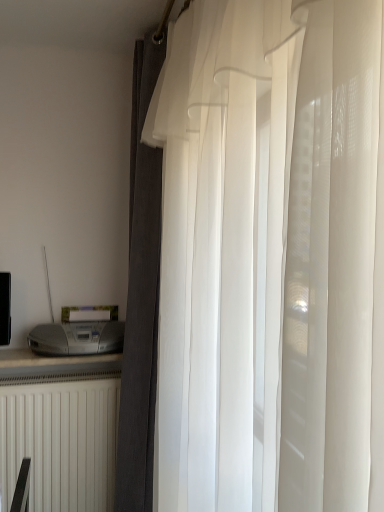
Question: Can you confirm if satin silver printer at lower left is taller than white matte radiator at lower left?

Choices:
 (A) no
 (B) yes

Answer: (A)

Question: From the image's perspective, is satin silver printer at lower left below white matte radiator at lower left?

Choices:
 (A) yes
 (B) no

Answer: (B)

Question: Considering the relative positions of satin silver printer at lower left and white matte radiator at lower left in the image provided, is satin silver printer at lower left behind white matte radiator at lower left?

Choices:
 (A) yes
 (B) no

Answer: (B)

Question: Is there a large distance between satin silver printer at lower left and white matte radiator at lower left?

Choices:
 (A) yes
 (B) no

Answer: (B)

Question: From a real-world perspective, is satin silver printer at lower left located beneath white matte radiator at lower left?

Choices:
 (A) yes
 (B) no

Answer: (B)

Question: Considering the relative sizes of satin silver printer at lower left and white matte radiator at lower left in the image provided, is satin silver printer at lower left shorter than white matte radiator at lower left?

Choices:
 (A) no
 (B) yes

Answer: (B)

Question: Does satin silver printer at lower left have a larger size compared to dark gray textured curtain at center, arranged as the 1th curtain when viewed from the back?

Choices:
 (A) yes
 (B) no

Answer: (B)

Question: Is satin silver printer at lower left not inside dark gray textured curtain at center, the second curtain from the front?

Choices:
 (A) yes
 (B) no

Answer: (A)

Question: Does satin silver printer at lower left have a greater width compared to dark gray textured curtain at center, the second curtain from the front?

Choices:
 (A) no
 (B) yes

Answer: (B)

Question: Would you say dark gray textured curtain at center, the second curtain from the front, is part of satin silver printer at lower left's contents?

Choices:
 (A) no
 (B) yes

Answer: (A)

Question: From the image's perspective, is satin silver printer at lower left over dark gray textured curtain at center, the second curtain from the front?

Choices:
 (A) yes
 (B) no

Answer: (B)

Question: Is satin silver printer at lower left oriented towards dark gray textured curtain at center, the second curtain from the front?

Choices:
 (A) yes
 (B) no

Answer: (B)

Question: From the image's perspective, would you say white matte radiator at lower left is positioned over translucent white curtain at center, positioned as the 1th curtain in front-to-back order?

Choices:
 (A) no
 (B) yes

Answer: (A)